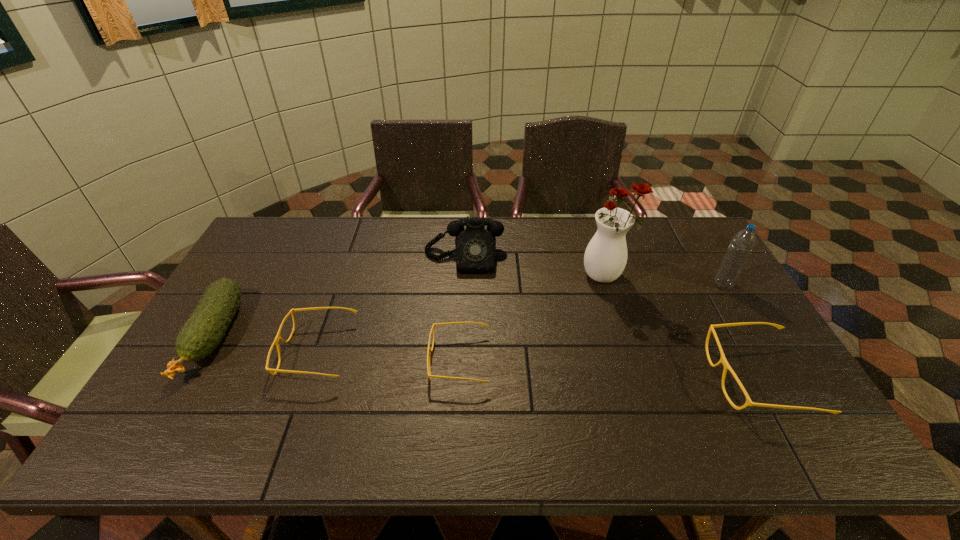
This screenshot has width=960, height=540. I want to click on vacant space at the far edge, so click(x=540, y=220).

Image resolution: width=960 pixels, height=540 pixels. Find the location of `free point at the near edge`. free point at the near edge is located at coordinates (604, 413).

This screenshot has width=960, height=540. In the image, there is a desktop. Identify the location of vacant space at the left edge. (276, 259).

The image size is (960, 540). Identify the location of vacant space at the far right corner of the desktop. (687, 246).

In order to click on free space between the shortest object and the telephone in this screenshot , I will do `click(462, 309)`.

The width and height of the screenshot is (960, 540). Find the location of `vacant area that lies between the rightmost spectacles and the second spectacles from left to right`. vacant area that lies between the rightmost spectacles and the second spectacles from left to right is located at coordinates (609, 369).

The width and height of the screenshot is (960, 540). I want to click on vacant space that's between the cucumber and the water bottle, so click(468, 310).

Find the location of a particular element. free point between the second object from left to right and the second tallest object is located at coordinates (520, 318).

At what (x,y) coordinates should I click in order to perform the action: click on empty location between the rightmost spectacles and the second shortest spectacles. Please return your answer as a coordinate pair (x, y). The height and width of the screenshot is (540, 960). Looking at the image, I should click on (538, 365).

Image resolution: width=960 pixels, height=540 pixels. In order to click on free space between the fourth tallest object and the third tallest object in this screenshot , I will do `click(339, 297)`.